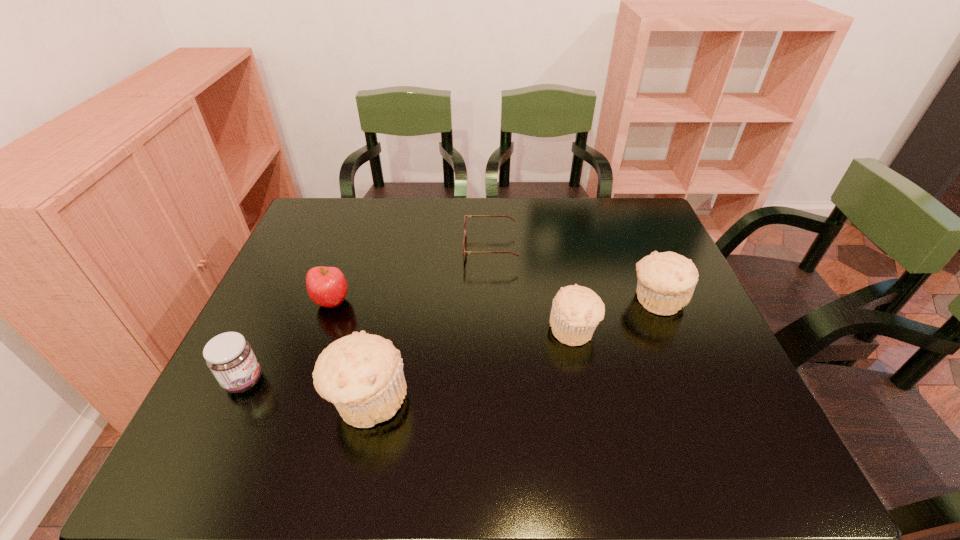
Find the location of a particular element. The image size is (960, 540). free space at the far right corner of the desktop is located at coordinates (640, 222).

At what (x,y) coordinates should I click in order to perform the action: click on blank space at the near right corner of the desktop. Please return your answer as a coordinate pair (x, y). Looking at the image, I should click on (709, 393).

Where is `free area in between the leftmost muffin and the shortest object`? The height and width of the screenshot is (540, 960). free area in between the leftmost muffin and the shortest object is located at coordinates (429, 325).

Find the location of a particular element. free space between the jam and the second object from left to right is located at coordinates (288, 341).

The height and width of the screenshot is (540, 960). In order to click on free spot between the second muffin from left to right and the fifth object from right to left in this screenshot , I will do `click(453, 316)`.

At what (x,y) coordinates should I click in order to perform the action: click on empty space between the jam and the farthest object. Please return your answer as a coordinate pair (x, y). Looking at the image, I should click on (368, 315).

Where is `free space between the spectacles and the jam`? free space between the spectacles and the jam is located at coordinates (368, 315).

Locate an element on the screen. Image resolution: width=960 pixels, height=540 pixels. free space between the leftmost object and the fifth object from right to left is located at coordinates (288, 341).

This screenshot has width=960, height=540. In order to click on free space between the leftmost object and the second shortest muffin in this screenshot , I will do `click(450, 341)`.

At what (x,y) coordinates should I click in order to perform the action: click on vacant point located between the apple and the farthest object. Please return your answer as a coordinate pair (x, y). Looking at the image, I should click on (412, 275).